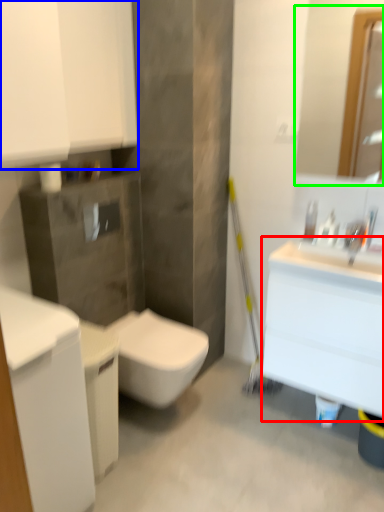
Question: Based on their relative distances, which object is farther from counter top (highlighted by a red box)? Choose from bathroom cabinet (highlighted by a blue box) and mirror (highlighted by a green box).

Choices:
 (A) bathroom cabinet
 (B) mirror

Answer: (B)